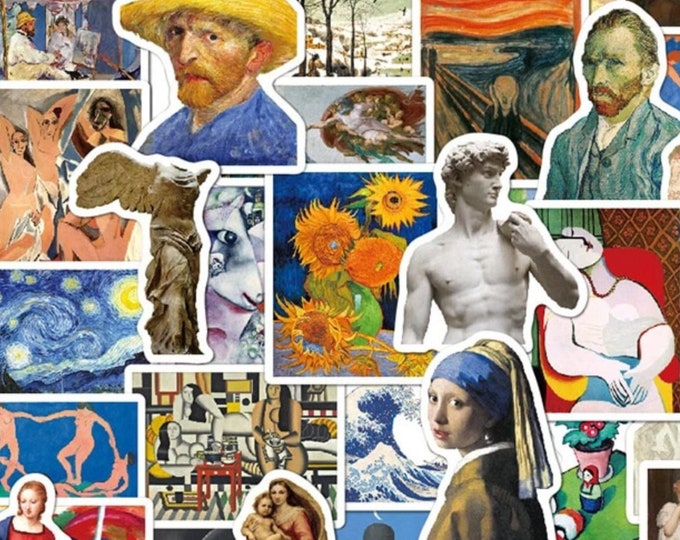
Locate an element on the screen. Image resolution: width=680 pixels, height=540 pixels. green table is located at coordinates (608, 498), (606, 531), (568, 489).